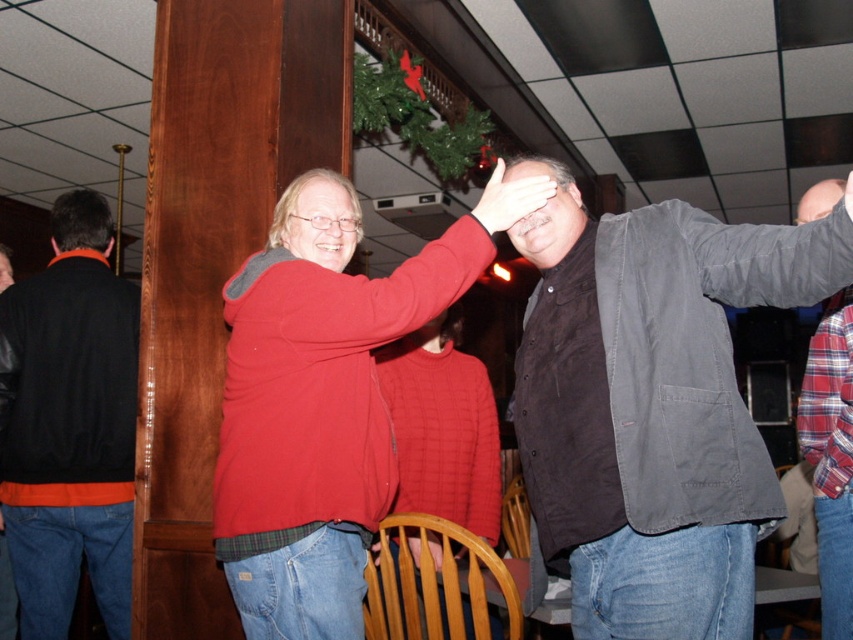
Based on the scene description, can you identify the object located at the coordinate point (830, 458)?

The object at point (830, 458) is the plaid flannel shirt at right.